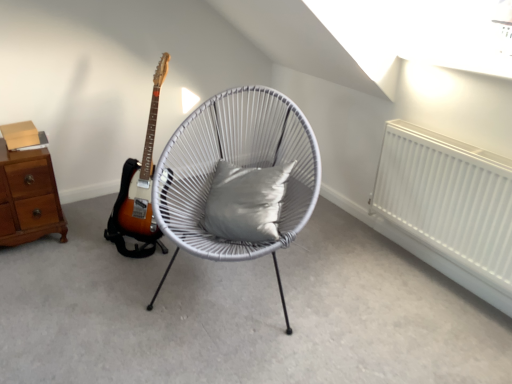
The height and width of the screenshot is (384, 512). Find the location of `vacant space in front of white woven chair at center`. vacant space in front of white woven chair at center is located at coordinates (222, 349).